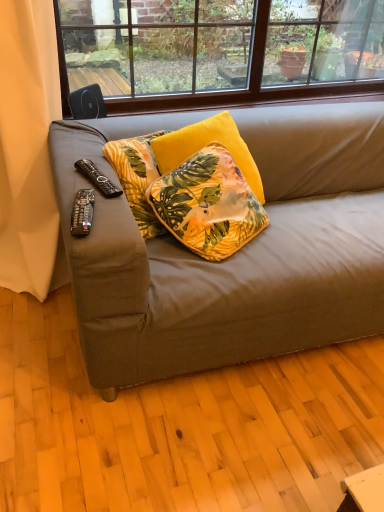
Describe the element at coordinates (82, 212) in the screenshot. Image resolution: width=384 pixels, height=512 pixels. I see `black plastic remote control at lower left, the second remote control viewed from the back` at that location.

Where is `beige fabric curtain at left`? This screenshot has height=512, width=384. beige fabric curtain at left is located at coordinates (29, 149).

I want to click on black plastic remote at left, marked as the first remote control in a top-to-bottom arrangement, so click(x=98, y=178).

Considering the positions of point (239, 325) and point (175, 199), is point (239, 325) closer or farther from the camera than point (175, 199)?

Point (239, 325) is closer to the camera than point (175, 199).

From the image's perspective, between matte brown fabric couch at center and velvet floral pillow at center, who is located below?

matte brown fabric couch at center, from the image's perspective.

Considering the relative positions of matte brown fabric couch at center and velvet floral pillow at center in the image provided, is matte brown fabric couch at center behind velvet floral pillow at center?

That is False.

How different are the orientations of matte brown fabric couch at center and velvet floral pillow at center in degrees?

There is a 35.8-degree angle between the facing directions of matte brown fabric couch at center and velvet floral pillow at center.

Considering the relative positions of matte brown fabric couch at center and beige fabric curtain at left in the image provided, is matte brown fabric couch at center behind beige fabric curtain at left?

No, matte brown fabric couch at center is in front of beige fabric curtain at left.

Which is correct: matte brown fabric couch at center is inside beige fabric curtain at left, or outside of it?

matte brown fabric couch at center is not inside beige fabric curtain at left, it's outside.

From the image's perspective, is matte brown fabric couch at center located beneath beige fabric curtain at left?

Yes, from the image's perspective, matte brown fabric couch at center is below beige fabric curtain at left.

From a real-world perspective, is matte brown fabric couch at center on top of beige fabric curtain at left?

No, from a real-world perspective, matte brown fabric couch at center is not on top of beige fabric curtain at left.

Is black plastic remote at left, which appears as the 2th remote control when ordered from the bottom, positioned far away from matte brown fabric couch at center?

No, black plastic remote at left, which appears as the 2th remote control when ordered from the bottom, is not far from matte brown fabric couch at center.

From the picture: Is black plastic remote at left, placed as the second remote control when sorted from front to back, aimed at matte brown fabric couch at center?

→ Yes, black plastic remote at left, placed as the second remote control when sorted from front to back, is facing matte brown fabric couch at center.

This screenshot has width=384, height=512. What are the coordinates of `remote control that is the 1st one above the matte brown fabric couch at center (from a real-world perspective)` in the screenshot? It's located at (98, 178).

Can matte brown fabric couch at center be found inside black plastic remote at left, which ranks as the first remote control in back-to-front order?

No.

Is point (90, 162) positioned before point (18, 15)?

Yes.

Is black plastic remote at left, marked as the first remote control in a top-to-bottom arrangement, outside of beige fabric curtain at left?

Yes, black plastic remote at left, marked as the first remote control in a top-to-bottom arrangement, is not within beige fabric curtain at left.

Looking at the image, does black plastic remote at left, placed as the second remote control when sorted from front to back, seem bigger or smaller compared to beige fabric curtain at left?

Considering their sizes, black plastic remote at left, placed as the second remote control when sorted from front to back, takes up less space than beige fabric curtain at left.

From the image's perspective, who appears lower, black plastic remote at left, marked as the first remote control in a top-to-bottom arrangement, or beige fabric curtain at left?

black plastic remote at left, marked as the first remote control in a top-to-bottom arrangement, appears lower in the image.

Measure the distance from beige fabric curtain at left to black plastic remote control at lower left, the first remote control from the bottom.

beige fabric curtain at left is 29.16 inches away from black plastic remote control at lower left, the first remote control from the bottom.

Looking at this image, are beige fabric curtain at left and black plastic remote control at lower left, which is counted as the second remote control, starting from the top, far apart?

No, beige fabric curtain at left is in close proximity to black plastic remote control at lower left, which is counted as the second remote control, starting from the top.

Which object is further away from the camera taking this photo, beige fabric curtain at left or black plastic remote control at lower left, which is counted as the second remote control, starting from the top?

Positioned behind is beige fabric curtain at left.

Where is `curtain that appears above the black plastic remote control at lower left, which is counted as the second remote control, starting from the top (from the image's perspective)`? The width and height of the screenshot is (384, 512). curtain that appears above the black plastic remote control at lower left, which is counted as the second remote control, starting from the top (from the image's perspective) is located at coordinates (29, 149).

Could you tell me if matte brown fabric couch at center is facing black plastic remote at left, marked as the first remote control in a top-to-bottom arrangement?

No.

Locate an element on the screen. remote control that is the 2nd object to the left of the matte brown fabric couch at center, starting at the anchor is located at coordinates (98, 178).

From the image's perspective, is matte brown fabric couch at center located above or below black plastic remote at left, marked as the first remote control in a top-to-bottom arrangement?

From the image's perspective, matte brown fabric couch at center appears below black plastic remote at left, marked as the first remote control in a top-to-bottom arrangement.

Considering the sizes of objects beige fabric curtain at left and black plastic remote at left, marked as the first remote control in a top-to-bottom arrangement, in the image provided, who is wider, beige fabric curtain at left or black plastic remote at left, marked as the first remote control in a top-to-bottom arrangement,?

beige fabric curtain at left is wider.

Would you say beige fabric curtain at left is a long distance from black plastic remote at left, marked as the first remote control in a top-to-bottom arrangement?

No.

Which object is closer to the camera taking this photo, beige fabric curtain at left or black plastic remote at left, which ranks as the first remote control in back-to-front order?

beige fabric curtain at left is closer to the camera.

How different are the orientations of beige fabric curtain at left and black plastic remote at left, marked as the first remote control in a top-to-bottom arrangement, in degrees?

The angular difference between beige fabric curtain at left and black plastic remote at left, marked as the first remote control in a top-to-bottom arrangement, is 14.4 degrees.

Where is `pillow behind the matte brown fabric couch at center`? This screenshot has height=512, width=384. pillow behind the matte brown fabric couch at center is located at coordinates (208, 204).

The width and height of the screenshot is (384, 512). Find the location of `curtain above the matte brown fabric couch at center (from a real-world perspective)`. curtain above the matte brown fabric couch at center (from a real-world perspective) is located at coordinates (29, 149).

Considering their positions, is beige fabric curtain at left positioned further to black plastic remote control at lower left, which is the 1th remote control in front-to-back order, than matte brown fabric couch at center?

beige fabric curtain at left is further to black plastic remote control at lower left, which is the 1th remote control in front-to-back order.

When comparing their distances from black plastic remote control at lower left, which is counted as the second remote control, starting from the top, does beige fabric curtain at left or black plastic remote at left, which ranks as the first remote control in back-to-front order, seem further?

beige fabric curtain at left is further to black plastic remote control at lower left, which is counted as the second remote control, starting from the top.

Considering their positions, is matte brown fabric couch at center positioned closer to black plastic remote control at lower left, which is the 1th remote control in front-to-back order, than velvet floral pillow at center?

velvet floral pillow at center.

From the image, which object appears to be nearer to beige fabric curtain at left, velvet floral pillow at center or matte brown fabric couch at center?

matte brown fabric couch at center is closer to beige fabric curtain at left.

When comparing their distances from black plastic remote control at lower left, which is counted as the second remote control, starting from the top, does velvet floral pillow at center or black plastic remote at left, placed as the second remote control when sorted from front to back, seem further?

Based on the image, velvet floral pillow at center appears to be further to black plastic remote control at lower left, which is counted as the second remote control, starting from the top.

From the image, which object appears to be farther from black plastic remote at left, placed as the second remote control when sorted from front to back, matte brown fabric couch at center or beige fabric curtain at left?

Based on the image, beige fabric curtain at left appears to be further to black plastic remote at left, placed as the second remote control when sorted from front to back.

Estimate the real-world distances between objects in this image. Which object is further from black plastic remote at left, which ranks as the first remote control in back-to-front order, beige fabric curtain at left or velvet floral pillow at center?

The object further to black plastic remote at left, which ranks as the first remote control in back-to-front order, is beige fabric curtain at left.

From the image, which object appears to be farther from velvet floral pillow at center, beige fabric curtain at left or matte brown fabric couch at center?

The object further to velvet floral pillow at center is beige fabric curtain at left.

In order to click on pillow situated between beige fabric curtain at left and matte brown fabric couch at center from left to right in this screenshot , I will do `click(208, 204)`.

Find the location of `remote control located between beige fabric curtain at left and black plastic remote control at lower left, the second remote control viewed from the back, in the left-right direction`. remote control located between beige fabric curtain at left and black plastic remote control at lower left, the second remote control viewed from the back, in the left-right direction is located at coordinates (98, 178).

The image size is (384, 512). Find the location of `pillow between black plastic remote at left, marked as the first remote control in a top-to-bottom arrangement, and matte brown fabric couch at center`. pillow between black plastic remote at left, marked as the first remote control in a top-to-bottom arrangement, and matte brown fabric couch at center is located at coordinates (208, 204).

The width and height of the screenshot is (384, 512). Find the location of `pillow located between black plastic remote control at lower left, which is the 1th remote control in front-to-back order, and matte brown fabric couch at center in the left-right direction`. pillow located between black plastic remote control at lower left, which is the 1th remote control in front-to-back order, and matte brown fabric couch at center in the left-right direction is located at coordinates (208, 204).